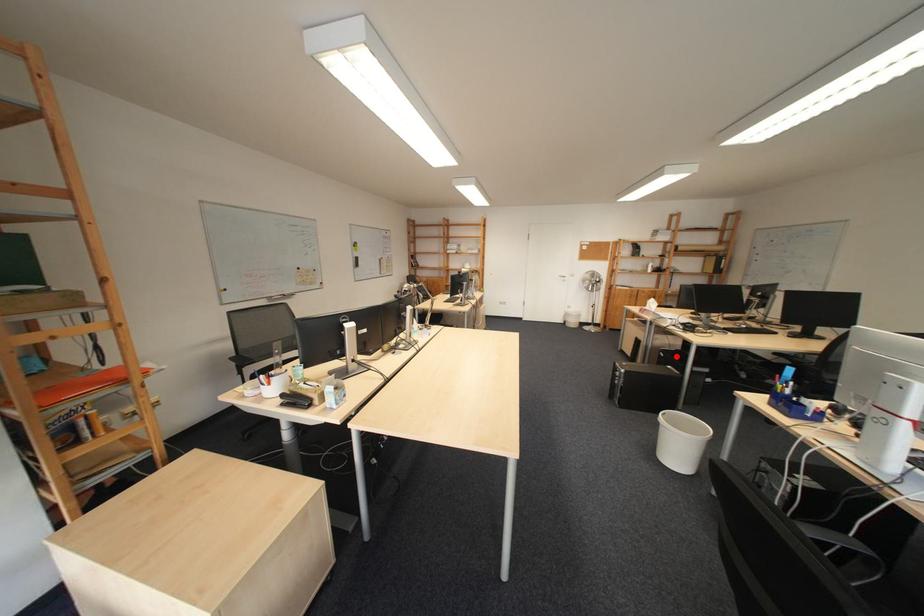
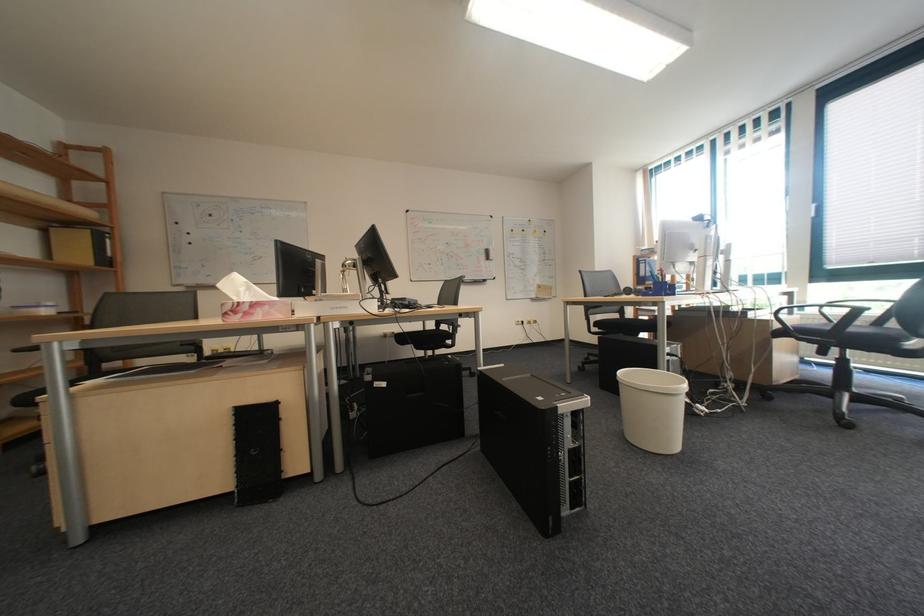
Where in the second image is the point corresponding to the highlighted location from the first image?

(398, 386)